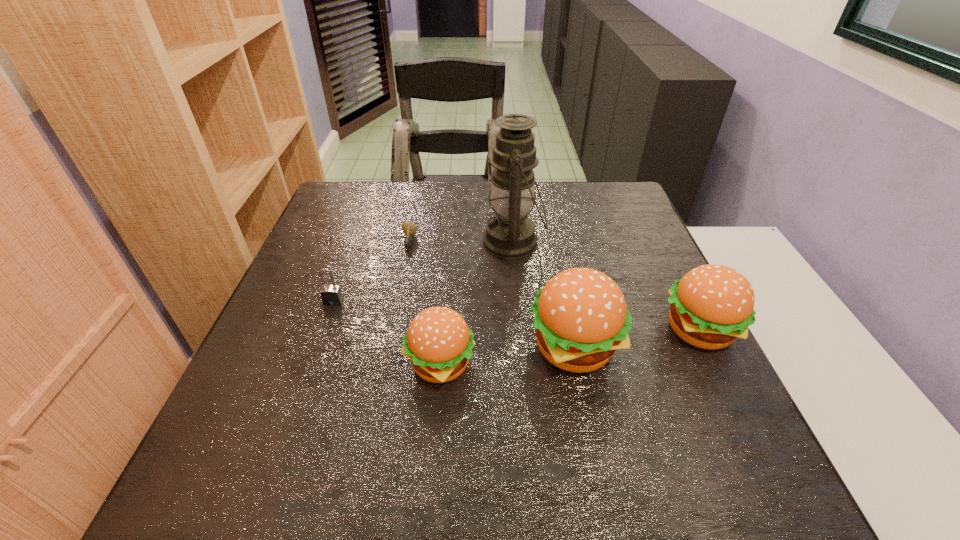
Identify the location of object that stands as the second closest to the oil lamp. Image resolution: width=960 pixels, height=540 pixels. (409, 229).

Where is `object that stands as the fifth closest to the second object from left to right`? This screenshot has width=960, height=540. object that stands as the fifth closest to the second object from left to right is located at coordinates (712, 305).

This screenshot has width=960, height=540. Find the location of `hamburger identified as the second closest to the tallest object`. hamburger identified as the second closest to the tallest object is located at coordinates (439, 343).

Locate an element on the screen. This screenshot has width=960, height=540. hamburger that can be found as the third closest to the tallest object is located at coordinates coord(712,305).

Identify the location of vacant position in the image that satisfies the following two spatial constraints: 1. on the front-facing side of the fifth object from right to left; 2. on the right side of the rightmost object. (392, 330).

Where is `vacant area that satisfies the following two spatial constraints: 1. on the shackle of the shortest hamburger; 2. on the right side of the fifth tallest object`? The image size is (960, 540). vacant area that satisfies the following two spatial constraints: 1. on the shackle of the shortest hamburger; 2. on the right side of the fifth tallest object is located at coordinates (311, 364).